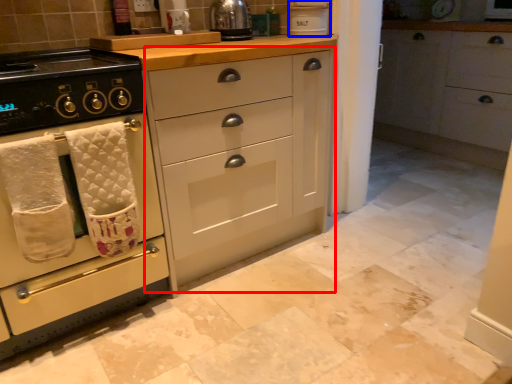
Question: Which of the following is the farthest to the observer, cabinetry (highlighted by a red box) or appliance (highlighted by a blue box)?

Choices:
 (A) cabinetry
 (B) appliance

Answer: (B)